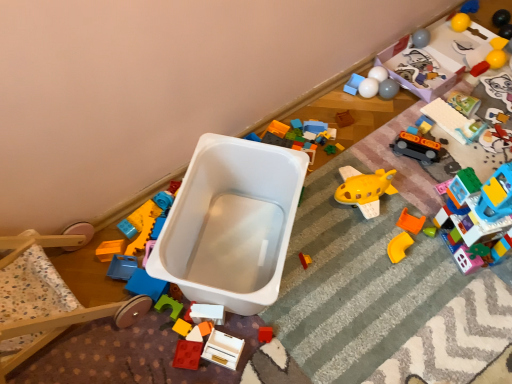
I want to click on free point to the right of wooden bunk bed at left, so click(157, 332).